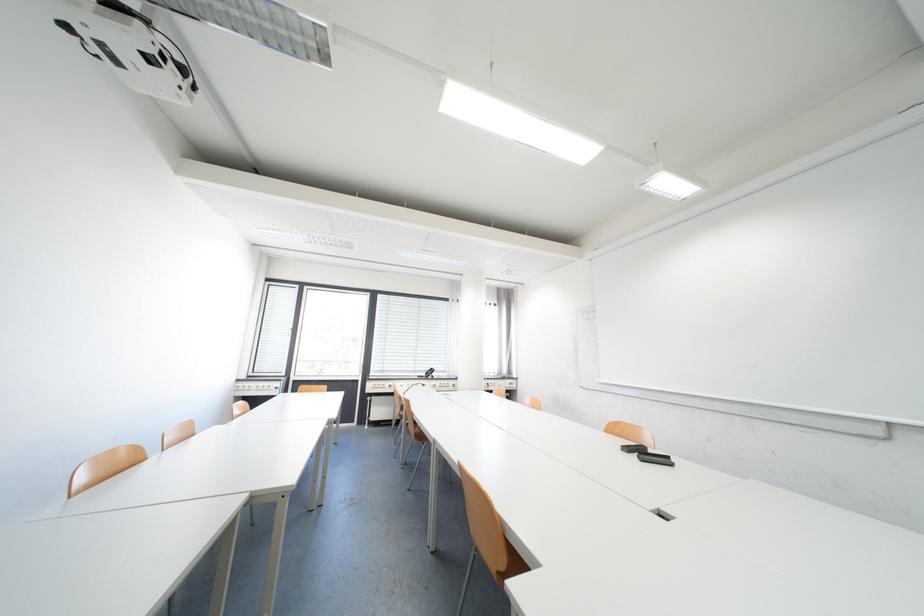
Find the location of a particular element. The height and width of the screenshot is (616, 924). projector screen handle is located at coordinates (128, 47).